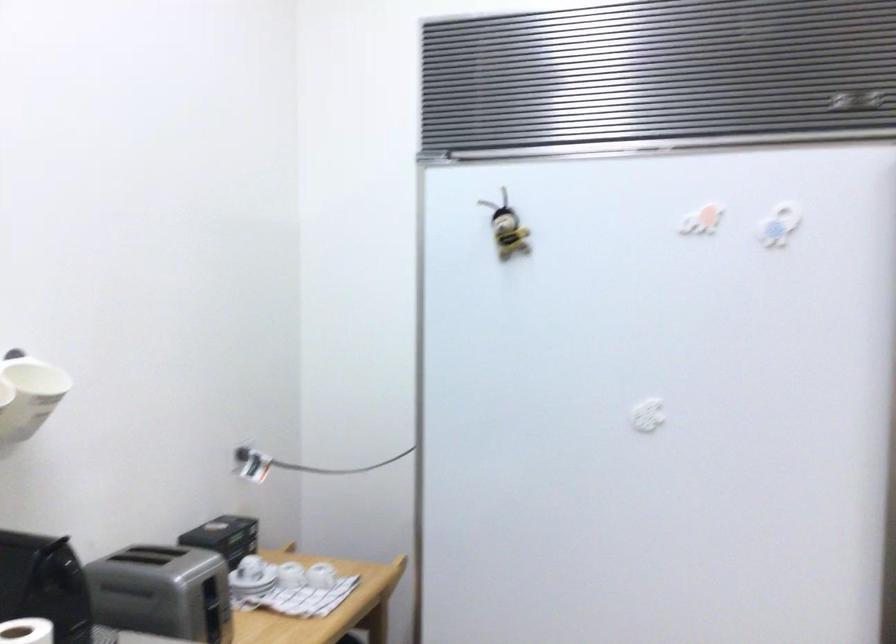
Locate an element on the screen. white electrical plug is located at coordinates (251, 462).